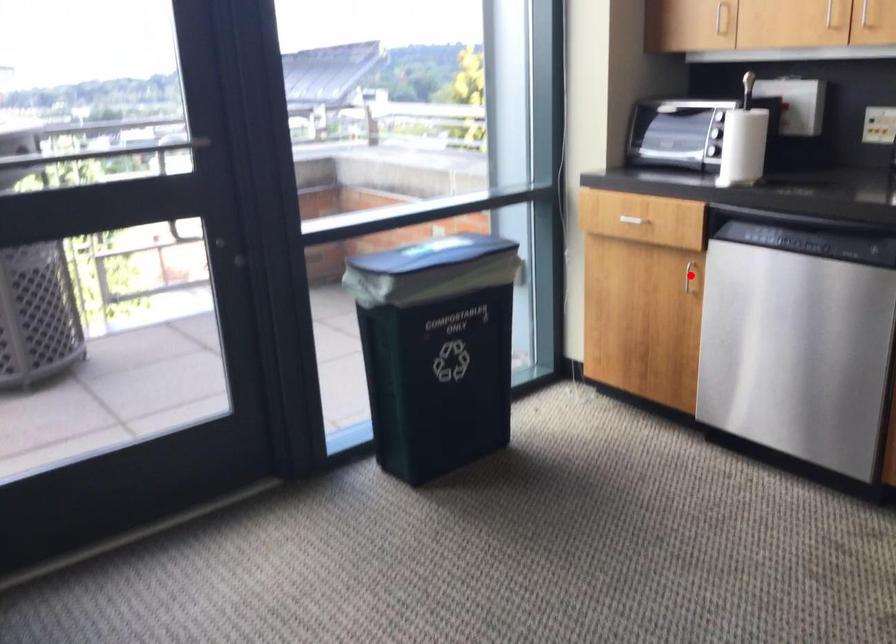
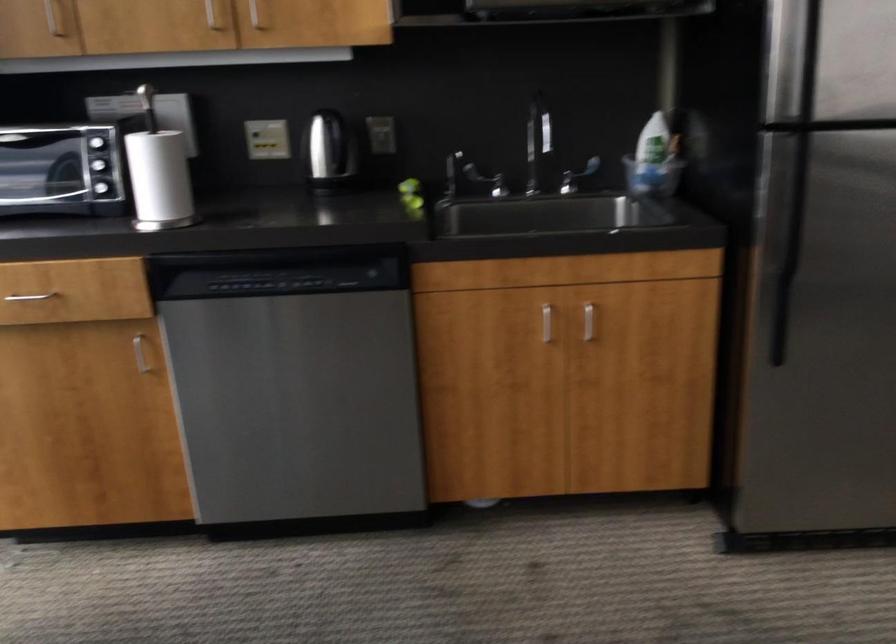
Find the pixel in the second image that matches the highlighted location in the first image.

(140, 354)